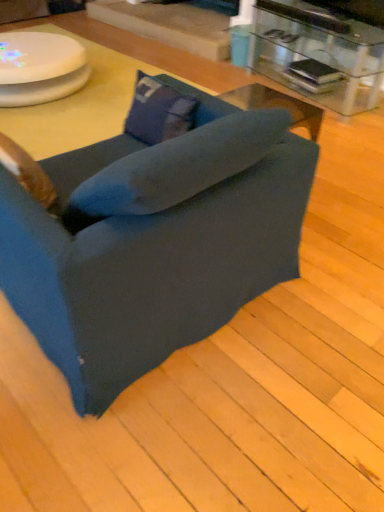
Locate an element on the screen. Image resolution: width=384 pixels, height=512 pixels. transparent glass table at upper right is located at coordinates (318, 54).

The height and width of the screenshot is (512, 384). What are the coordinates of `blue fabric pillow at center` in the screenshot? It's located at (158, 111).

Locate an element on the screen. transparent glass table at upper right is located at coordinates (318, 54).

From a real-world perspective, is transparent glass table at upper right over blue fabric pillow at center?

Actually, transparent glass table at upper right is physically below blue fabric pillow at center in the real world.

From the image's perspective, between transparent glass table at upper right and blue fabric pillow at center, who is located below?

From the image's view, blue fabric pillow at center is below.

Would you say blue fabric pillow at center is part of transparent glass table at upper right's contents?

No.

From the image's perspective, who appears lower, dark blue fabric chair at center or blue fabric pillow at center?

dark blue fabric chair at center is shown below in the image.

Is dark blue fabric chair at center at the left side of blue fabric pillow at center?

Yes.

Looking at their sizes, would you say dark blue fabric chair at center is wider or thinner than blue fabric pillow at center?

In the image, dark blue fabric chair at center appears to be wider than blue fabric pillow at center.

Which object is positioned more to the left, transparent glass table at upper right or white glossy round table at upper left?

Positioned to the left is white glossy round table at upper left.

Based on the photo, which of these two, transparent glass table at upper right or white glossy round table at upper left, is wider?

white glossy round table at upper left is wider.

From a real-world perspective, which is physically above, transparent glass table at upper right or white glossy round table at upper left?

From a 3D spatial view, transparent glass table at upper right is above.

Measure the distance from transparent glass table at upper right to white glossy round table at upper left.

transparent glass table at upper right is 5.94 feet from white glossy round table at upper left.

Can you tell me how much transparent glass table at upper right and dark blue fabric chair at center differ in facing direction?

The angular difference between transparent glass table at upper right and dark blue fabric chair at center is 80.7 degrees.

Is transparent glass table at upper right bigger or smaller than dark blue fabric chair at center?

transparent glass table at upper right is smaller than dark blue fabric chair at center.

Could you tell me if transparent glass table at upper right is turned towards dark blue fabric chair at center?

Yes, transparent glass table at upper right faces towards dark blue fabric chair at center.

Is point (160, 117) closer or farther from the camera than point (371, 55)?

Point (160, 117).

From a real-world perspective, between blue fabric pillow at center and transparent glass table at upper right, who is vertically lower?

In real-world perspective, transparent glass table at upper right is lower.

Would you say blue fabric pillow at center is outside transparent glass table at upper right?

Yes, blue fabric pillow at center is located beyond the bounds of transparent glass table at upper right.

Are blue fabric pillow at center and transparent glass table at upper right beside each other?

They are not placed beside each other.

You are a GUI agent. You are given a task and a screenshot of the screen. Output one action in this format:
    pyautogui.click(x=<x>, y=<y>)
    Task: Click on the table above the white glossy round table at upper left (from a real-world perspective)
    The width and height of the screenshot is (384, 512).
    Given the screenshot: What is the action you would take?
    pyautogui.click(x=318, y=54)

Does white glossy round table at upper left turn towards transparent glass table at upper right?

No.

Is transparent glass table at upper right surrounded by white glossy round table at upper left?

That's incorrect, transparent glass table at upper right is not inside white glossy round table at upper left.

Does white glossy round table at upper left come behind dark blue fabric chair at center?

Yes.

Is white glossy round table at upper left bigger or smaller than dark blue fabric chair at center?

Considering their sizes, white glossy round table at upper left takes up less space than dark blue fabric chair at center.

Is white glossy round table at upper left oriented towards dark blue fabric chair at center?

No, white glossy round table at upper left is not turned towards dark blue fabric chair at center.

The height and width of the screenshot is (512, 384). Find the location of `table above the blue fabric pillow at center (from the image's perspective)`. table above the blue fabric pillow at center (from the image's perspective) is located at coordinates (318, 54).

This screenshot has height=512, width=384. Identify the location of chair below the blue fabric pillow at center (from the image's perspective). (154, 239).

Which object lies nearer to the anchor point dark blue fabric chair at center, transparent glass table at upper right or white glossy round table at upper left?

The object closer to dark blue fabric chair at center is white glossy round table at upper left.

Which object lies nearer to the anchor point blue fabric pillow at center, transparent glass table at upper right or white glossy round table at upper left?

The object closer to blue fabric pillow at center is white glossy round table at upper left.

When comparing their distances from transparent glass table at upper right, does white glossy round table at upper left or dark blue fabric chair at center seem further?

Among the two, dark blue fabric chair at center is located further to transparent glass table at upper right.

Looking at the image, which one is located further to dark blue fabric chair at center, blue fabric pillow at center or transparent glass table at upper right?

transparent glass table at upper right.

From the image, which object appears to be nearer to blue fabric pillow at center, dark blue fabric chair at center or transparent glass table at upper right?

Among the two, dark blue fabric chair at center is located nearer to blue fabric pillow at center.

Based on their spatial positions, is dark blue fabric chair at center or white glossy round table at upper left closer to transparent glass table at upper right?

white glossy round table at upper left lies closer to transparent glass table at upper right than the other object.

Looking at the image, which one is located closer to white glossy round table at upper left, dark blue fabric chair at center or transparent glass table at upper right?

Among the two, transparent glass table at upper right is located nearer to white glossy round table at upper left.

From the image, which object appears to be farther from blue fabric pillow at center, transparent glass table at upper right or dark blue fabric chair at center?

transparent glass table at upper right is further to blue fabric pillow at center.

What are the coordinates of `pillow located between white glossy round table at upper left and transparent glass table at upper right in the left-right direction` in the screenshot? It's located at point(158,111).

Identify the location of chair between white glossy round table at upper left and transparent glass table at upper right. This screenshot has width=384, height=512. (154, 239).

Identify the location of pillow between dark blue fabric chair at center and transparent glass table at upper right from front to back. The image size is (384, 512). (158, 111).

Find the location of `pillow between dark blue fabric chair at center and white glossy round table at upper left in the front-back direction`. pillow between dark blue fabric chair at center and white glossy round table at upper left in the front-back direction is located at coordinates (158, 111).